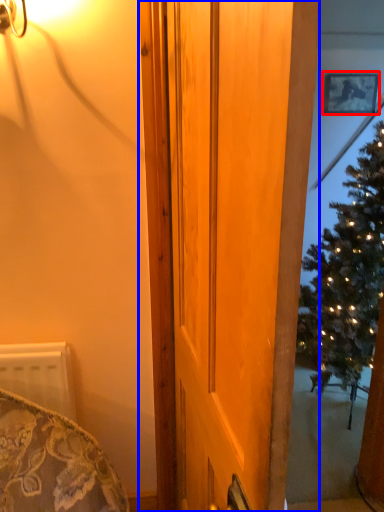
Question: Which object appears closest to the camera in this image, picture frame (highlighted by a red box) or door (highlighted by a blue box)?

Choices:
 (A) picture frame
 (B) door

Answer: (B)